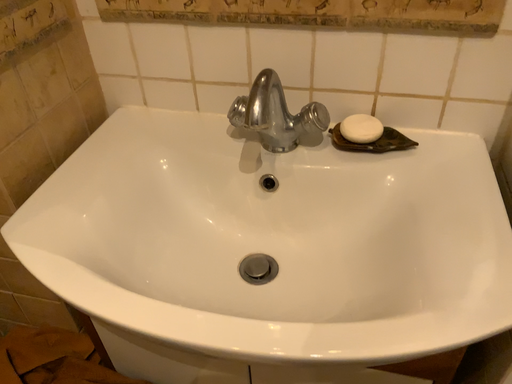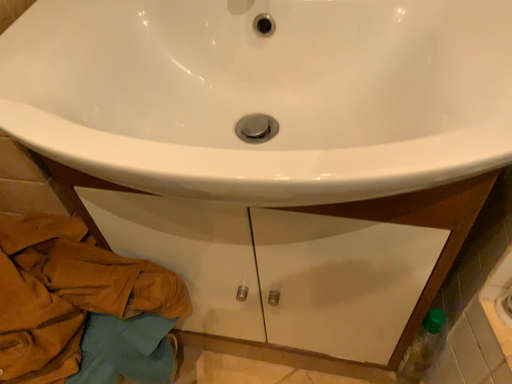
Question: Which way did the camera rotate in the video?

Choices:
 (A) rotated upward
 (B) rotated downward

Answer: (B)